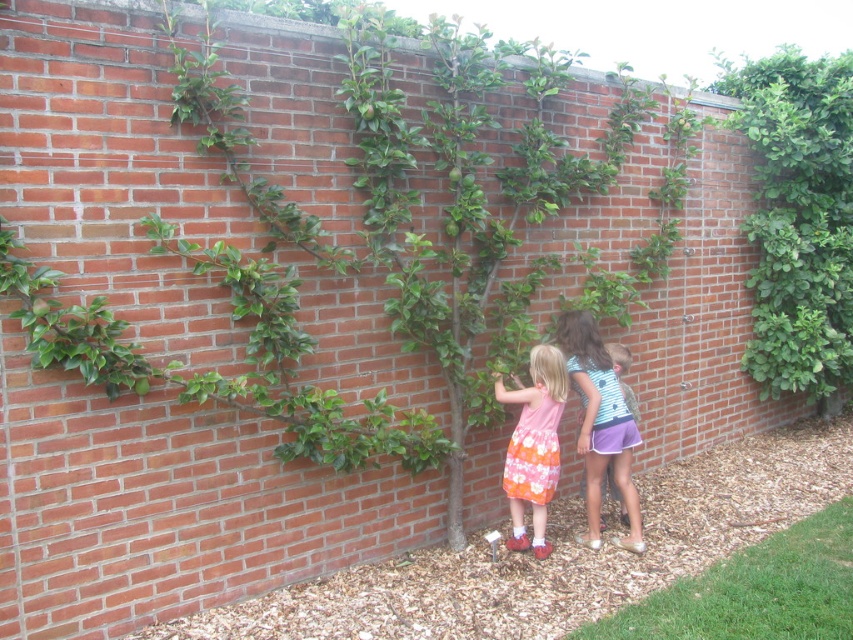
You are standing 5 meters away from the green leafy bush at upper right. Can you reach it by taking one step forward?

The green leafy bush at upper right is 4.91 meters away from the viewer. Since you are currently 5 meters away, taking one step forward would bring you closer, but it is unlikely to reduce the distance by 0.09 meters. Therefore, you cannot reach it with one step.

You are a photographer trying to capture a candid shot of the striped cotton shirt at center and the floral cotton dress at center. Since you want to ensure both are in focus, you need to know their vertical positions. Which one is higher up?

The striped cotton shirt at center is above the floral cotton dress at center, so it is higher up.

You are standing in a garden and see the striped cotton shirt at center. If you want to take a photo of it with your phone camera, which has a maximum focus range of 3 meters, will you need to move closer to get a clear shot?

The striped cotton shirt at center is 3.68 meters away from the camera. Since your phone camera can only focus up to 3 meters, you need to move closer to within 3 meters to capture a clear image.